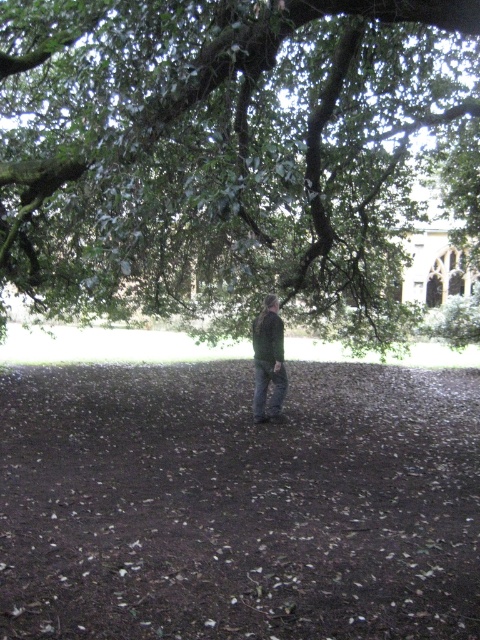
Can you confirm if green leafy tree at upper center is shorter than brown soil at center?

In fact, green leafy tree at upper center may be taller than brown soil at center.

Can you confirm if green leafy tree at upper center is positioned below brown soil at center?

Actually, green leafy tree at upper center is above brown soil at center.

Is point (143, 84) positioned after point (229, 461)?

No, it is in front of (229, 461).

Identify the location of green leafy tree at upper center. (216, 147).

Based on the photo, does green leafy tree at upper center appear on the right side of green matte jacket at center?

In fact, green leafy tree at upper center is to the left of green matte jacket at center.

Can you confirm if green leafy tree at upper center is thinner than green matte jacket at center?

No, green leafy tree at upper center is not thinner than green matte jacket at center.

Between point (152, 260) and point (255, 372), which one is positioned in front?

Point (255, 372) is more forward.

Where is `green leafy tree at upper center`? This screenshot has width=480, height=640. green leafy tree at upper center is located at coordinates (216, 147).

From the picture: Is brown soil at center to the left of green matte jacket at center from the viewer's perspective?

Yes, brown soil at center is to the left of green matte jacket at center.

Who is taller, brown soil at center or green matte jacket at center?

green matte jacket at center

Between point (330, 536) and point (252, 413), which one is positioned behind?

The point (252, 413) is more distant.

Where is `brown soil at center`? Image resolution: width=480 pixels, height=640 pixels. brown soil at center is located at coordinates (239, 502).